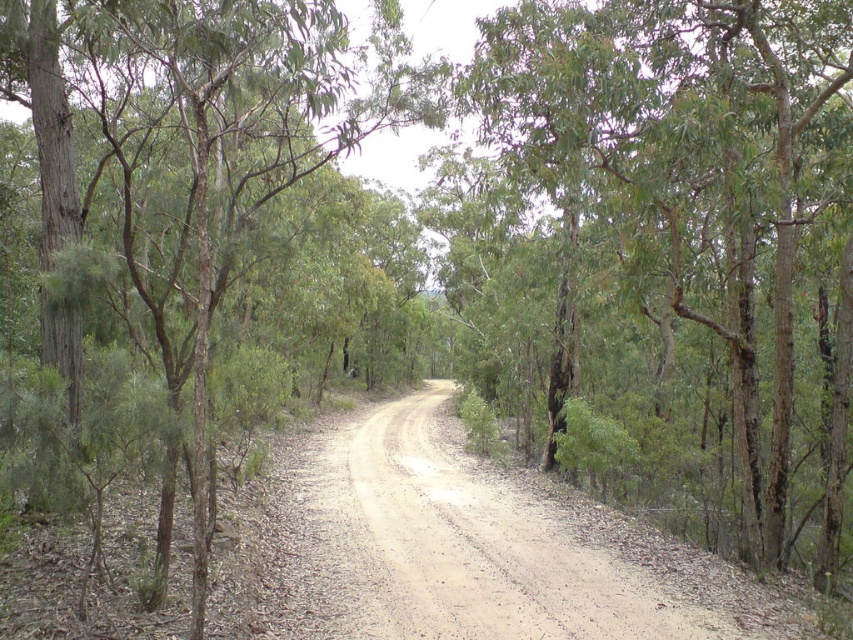
Who is more distant from viewer, (637,314) or (177,289)?

Point (637,314)

Who is higher up, green rough bark tree at center or brown rough tree at center?

brown rough tree at center is higher up.

Which is in front, point (680, 296) or point (186, 244)?

Point (186, 244) is in front.

At what (x,y) coordinates should I click in order to perform the action: click on green rough bark tree at center. Please return your answer as a coordinate pair (x, y). This screenshot has width=853, height=640. Looking at the image, I should click on (675, 246).

In the scene shown: Does green rough bark tree at center appear on the left side of dusty gravel road at center?

No, green rough bark tree at center is not to the left of dusty gravel road at center.

Is point (576, 22) positioned in front of point (791, 627)?

No, (576, 22) is behind (791, 627).

Where is `green rough bark tree at center`? green rough bark tree at center is located at coordinates (675, 246).

Between point (450, 563) and point (228, 259), which one is positioned behind?

The point (450, 563) is behind.

Locate an element on the screen. This screenshot has width=853, height=640. dusty gravel road at center is located at coordinates (485, 548).